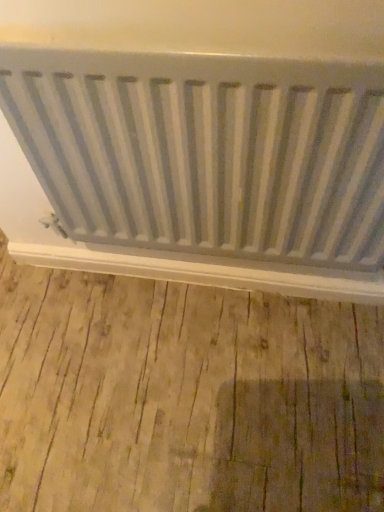
Find the location of a particular element. The height and width of the screenshot is (512, 384). vacant space to the left of white matte radiator at lower center is located at coordinates (89, 325).